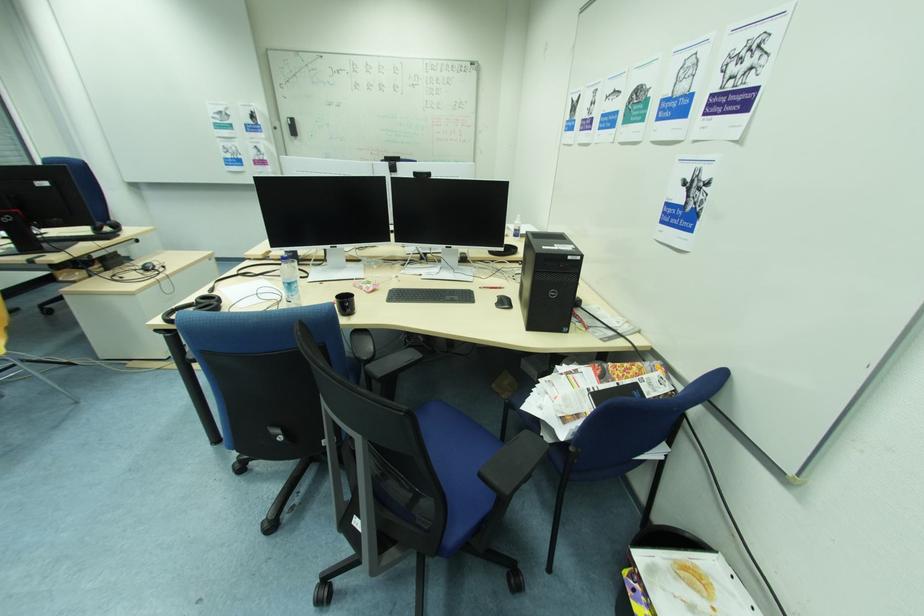
Where is `plastic water bottle`? plastic water bottle is located at coordinates (289, 280).